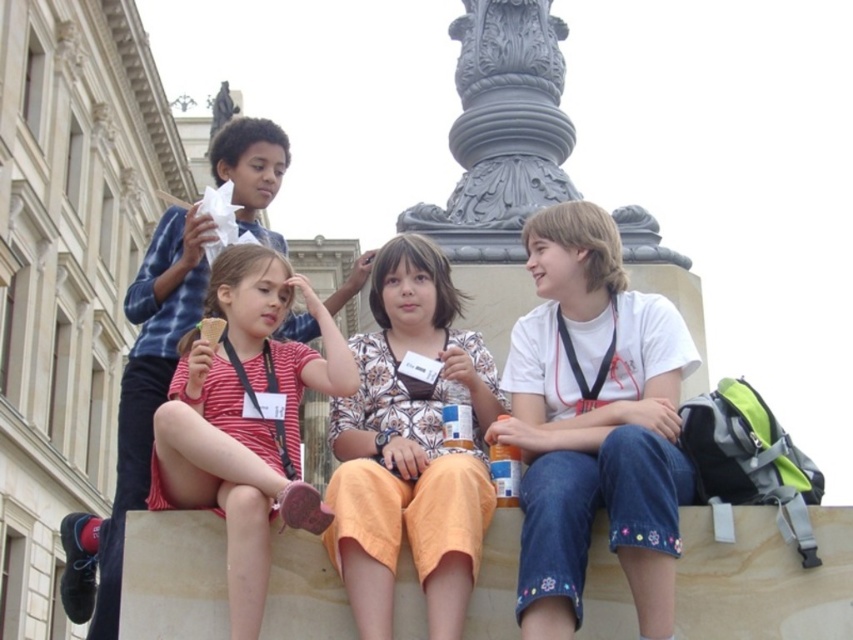
Is floral-patterned shirt at center closer to camera compared to striped cotton shirt at center?

Yes, it is in front of striped cotton shirt at center.

Can you confirm if floral-patterned shirt at center is thinner than striped cotton shirt at center?

Yes, floral-patterned shirt at center is thinner than striped cotton shirt at center.

Which is behind, point (334, 534) or point (244, 426)?

The point (244, 426) is more distant.

Locate an element on the screen. The width and height of the screenshot is (853, 640). floral-patterned shirt at center is located at coordinates (410, 448).

Between floral-patterned shirt at center and gray stone column at center, which one appears on the left side from the viewer's perspective?

From the viewer's perspective, floral-patterned shirt at center appears more on the left side.

Between floral-patterned shirt at center and gray stone column at center, which one has less height?

floral-patterned shirt at center

Between point (332, 483) and point (451, 221), which one is positioned behind?

The point (451, 221) is behind.

Locate an element on the screen. This screenshot has width=853, height=640. floral-patterned shirt at center is located at coordinates (410, 448).

Between striped cotton shirt at center and gray stone column at center, which one has more height?

gray stone column at center

Does striped cotton shirt at center have a larger size compared to gray stone column at center?

Actually, striped cotton shirt at center might be smaller than gray stone column at center.

Measure the distance between point [344,346] and camera.

Point [344,346] and camera are 75.86 feet apart from each other.

Identify the location of striped cotton shirt at center. (247, 417).